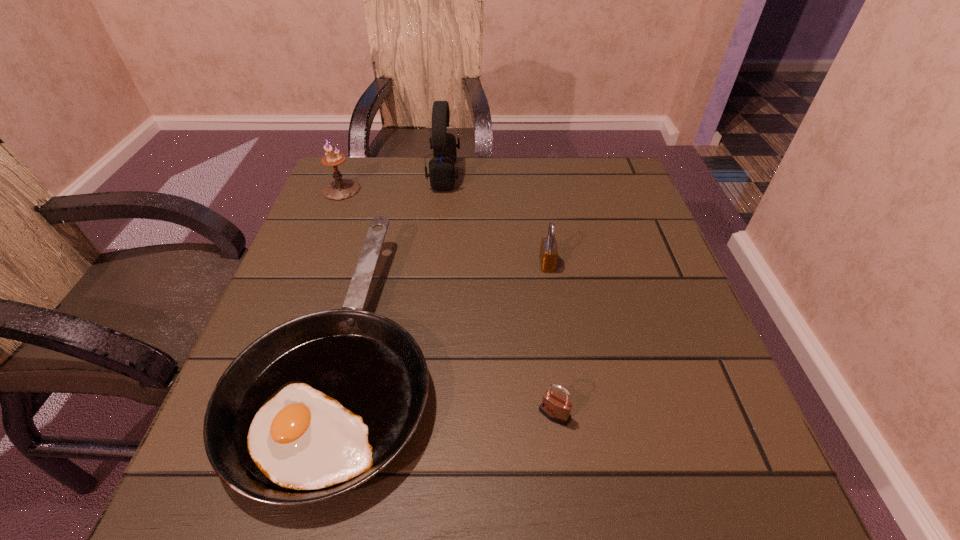
Locate an element on the screen. free region at the right edge of the desktop is located at coordinates (671, 349).

In the image, there is a desktop. Identify the location of vacant space at the far left corner. (351, 171).

In the image, there is a desktop. Identify the location of vacant region at the far right corner. (612, 195).

Find the location of a particular element. Image resolution: width=960 pixels, height=540 pixels. vacant point located between the nearer padlock and the frying pan is located at coordinates (449, 380).

Image resolution: width=960 pixels, height=540 pixels. In order to click on vacant area that lies between the second tallest object and the frying pan in this screenshot , I will do `click(343, 267)`.

Image resolution: width=960 pixels, height=540 pixels. In order to click on empty location between the shorter padlock and the second tallest object in this screenshot , I will do `click(447, 302)`.

Locate an element on the screen. This screenshot has width=960, height=540. free space between the headset and the second tallest object is located at coordinates (393, 182).

Locate an element on the screen. The height and width of the screenshot is (540, 960). unoccupied area between the tallest object and the third shortest object is located at coordinates (495, 219).

The width and height of the screenshot is (960, 540). I want to click on empty space that is in between the shorter padlock and the tallest object, so click(499, 294).

At what (x,y) coordinates should I click in order to perform the action: click on vacant region between the frying pan and the tallest object. Please return your answer as a coordinate pair (x, y). The width and height of the screenshot is (960, 540). Looking at the image, I should click on (395, 260).